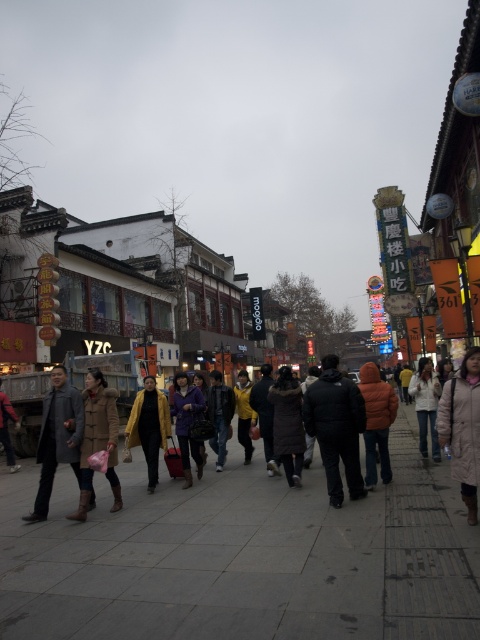
Question: Does yellow matte coat at center appear under brown leather jacket at lower left?

Choices:
 (A) yes
 (B) no

Answer: (B)

Question: Which object appears farthest from the camera in this image?

Choices:
 (A) brown leather jacket at lower left
 (B) matte purple coat at center
 (C) gray concrete pavement at center

Answer: (A)

Question: Which point appears closest to the camera in this image?

Choices:
 (A) (310, 392)
 (B) (192, 451)
 (C) (278, 516)

Answer: (C)

Question: Does orange puffy jacket at center appear over brown leather jacket at lower left?

Choices:
 (A) yes
 (B) no

Answer: (A)

Question: Which point is farther from the camera taking this photo?

Choices:
 (A) (416, 374)
 (B) (371, 429)
 (C) (144, 384)

Answer: (C)

Question: Does dark gray coat at center have a greater width compared to dark gray wool coat at left?

Choices:
 (A) no
 (B) yes

Answer: (B)